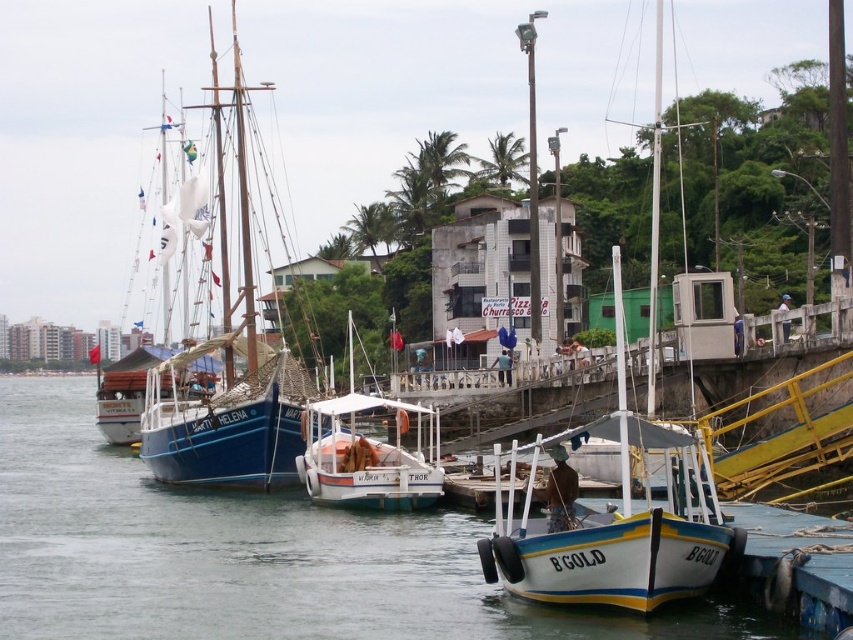
Between clear water at boat right and white matte boat at center, which one is positioned lower?

clear water at boat right is lower down.

The image size is (853, 640). What do you see at coordinates (247, 556) in the screenshot?
I see `clear water at boat right` at bounding box center [247, 556].

Which is in front, point (733, 624) or point (440, 477)?

Point (733, 624) is in front.

The height and width of the screenshot is (640, 853). I want to click on clear water at boat right, so coord(247,556).

Can you confirm if clear water at boat right is positioned to the left of white matte sailboat at center?

Indeed, clear water at boat right is positioned on the left side of white matte sailboat at center.

Who is more forward, (x=115, y=512) or (x=693, y=529)?

Positioned in front is point (x=693, y=529).

Is point (415, 556) positioned in front of point (624, 560)?

No, it is not.

Where is `clear water at boat right`? clear water at boat right is located at coordinates (247, 556).

Is blue wooden sailboat at left shorter than white matte boat at center?

No, blue wooden sailboat at left is not shorter than white matte boat at center.

Consider the image. Which of these two, blue wooden sailboat at left or white matte boat at center, stands shorter?

white matte boat at center is shorter.

Which is in front, point (231, 152) or point (399, 442)?

Point (399, 442)

I want to click on blue wooden sailboat at left, so click(x=233, y=332).